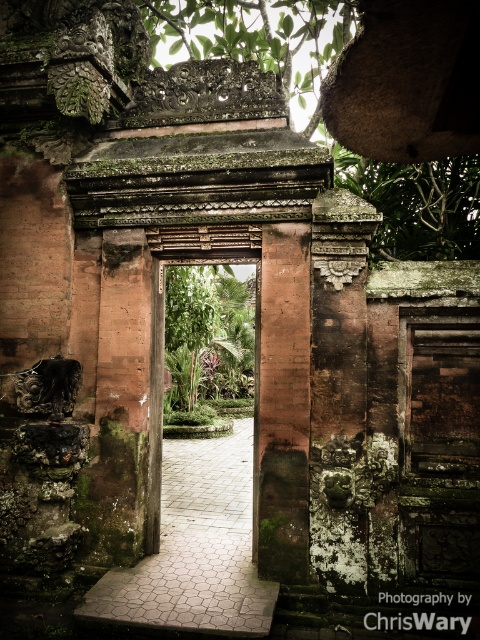
Question: Does smooth stone path at center appear on the right side of brown stone pillar at center?

Choices:
 (A) no
 (B) yes

Answer: (A)

Question: Is brown stone pillar at center to the right of green leafy plant at center from the viewer's perspective?

Choices:
 (A) no
 (B) yes

Answer: (B)

Question: Among these objects, which one is farthest from the camera?

Choices:
 (A) green leafy plant at center
 (B) brown stone pillar at center

Answer: (A)

Question: Does brown stone pillar at center have a lesser width compared to green leafy plant at center?

Choices:
 (A) yes
 (B) no

Answer: (A)

Question: Which object appears closest to the camera in this image?

Choices:
 (A) smooth stone path at center
 (B) green leafy plant at center

Answer: (A)

Question: Which object is positioned closest to the brown stone pillar at center?

Choices:
 (A) green leafy plant at center
 (B) smooth stone path at center

Answer: (B)